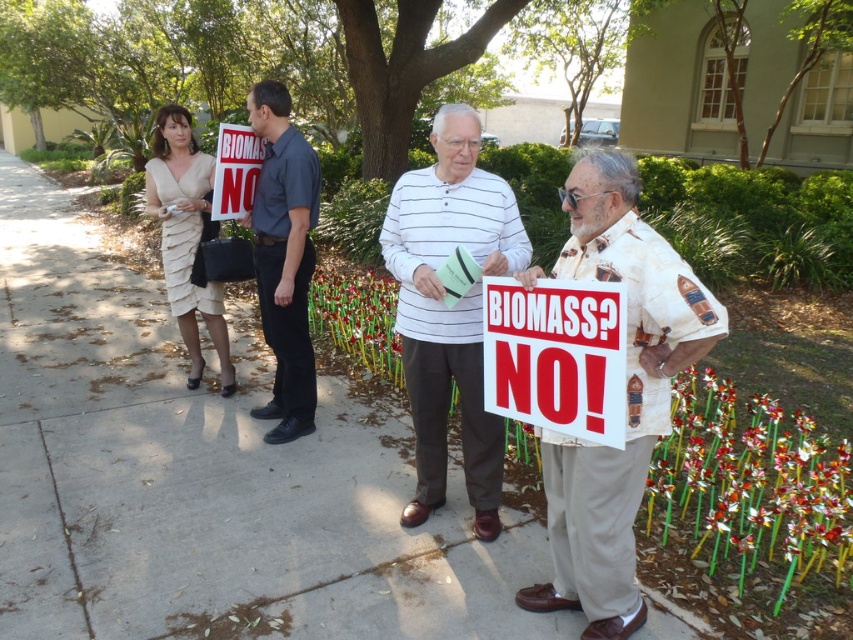
Describe the element at coordinates (450, 308) in the screenshot. I see `white striped shirt at center` at that location.

Find the location of a particular element. The width and height of the screenshot is (853, 640). white striped shirt at center is located at coordinates (450, 308).

Based on the photo, does beige printed shirt at right come behind white paper sign at center?

No, it is not.

Is point (567, 186) behind point (221, 166)?

No.

Where is `beige printed shirt at right`? This screenshot has height=640, width=853. beige printed shirt at right is located at coordinates (625, 394).

Can you confirm if concrete sidewalk at center is bigger than white paper sign at center?

Indeed, concrete sidewalk at center has a larger size compared to white paper sign at center.

This screenshot has height=640, width=853. Describe the element at coordinates (207, 477) in the screenshot. I see `concrete sidewalk at center` at that location.

The width and height of the screenshot is (853, 640). Identify the location of concrete sidewalk at center. (207, 477).

You are a GUI agent. You are given a task and a screenshot of the screen. Output one action in this format:
    pyautogui.click(x=<x>, y=<y>)
    Task: Click on the concrete sidewalk at center
    Image resolution: width=853 pixels, height=640 pixels.
    Given the screenshot: What is the action you would take?
    pyautogui.click(x=207, y=477)